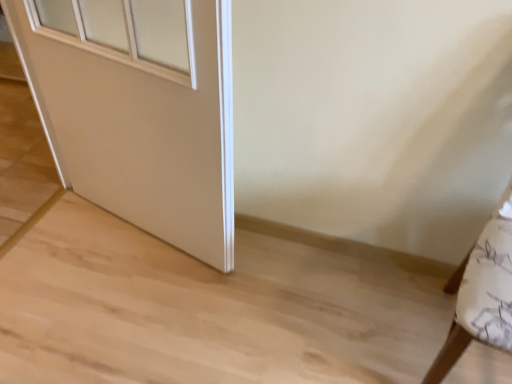
Locate an element on the screen. The image size is (512, 384). vacant space in front of white matte door at center is located at coordinates (156, 339).